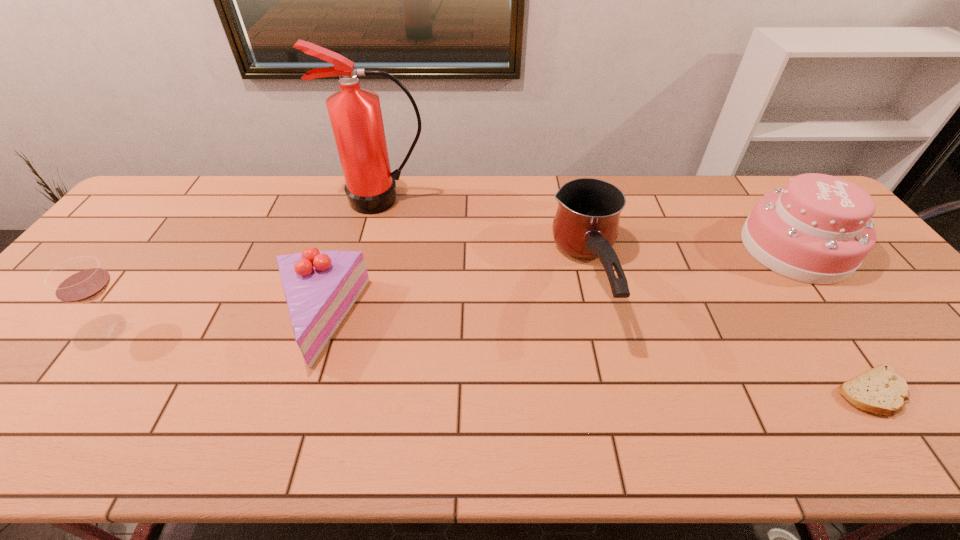
At what (x,y) coordinates should I click in order to perform the action: click on vacant space at the near edge of the desktop. Please return your answer as a coordinate pair (x, y). This screenshot has height=540, width=960. Looking at the image, I should click on (900, 419).

Where is `vacant space at the left edge of the desktop`? This screenshot has width=960, height=540. vacant space at the left edge of the desktop is located at coordinates (65, 333).

Find the location of a particular element. This screenshot has height=540, width=960. vacant region at the right edge of the desktop is located at coordinates (895, 320).

What are the coordinates of `vacant space at the far left corner` in the screenshot? It's located at (168, 205).

This screenshot has width=960, height=540. I want to click on vacant point located between the leftmost object and the fire extinguisher, so click(252, 262).

Find the location of `vacant area that lies between the shorter cake and the shortest object`. vacant area that lies between the shorter cake and the shortest object is located at coordinates (594, 356).

Find the location of a particular element. This screenshot has width=960, height=540. empty space between the wineglass and the left cake is located at coordinates (219, 322).

This screenshot has height=540, width=960. I want to click on vacant space that is in between the leftmost object and the fifth tallest object, so click(x=219, y=322).

Locate an element on the screen. This screenshot has height=540, width=960. free space between the saucepan and the second shortest object is located at coordinates (453, 299).

This screenshot has height=540, width=960. I want to click on vacant point located between the saucepan and the shortest object, so click(x=730, y=335).